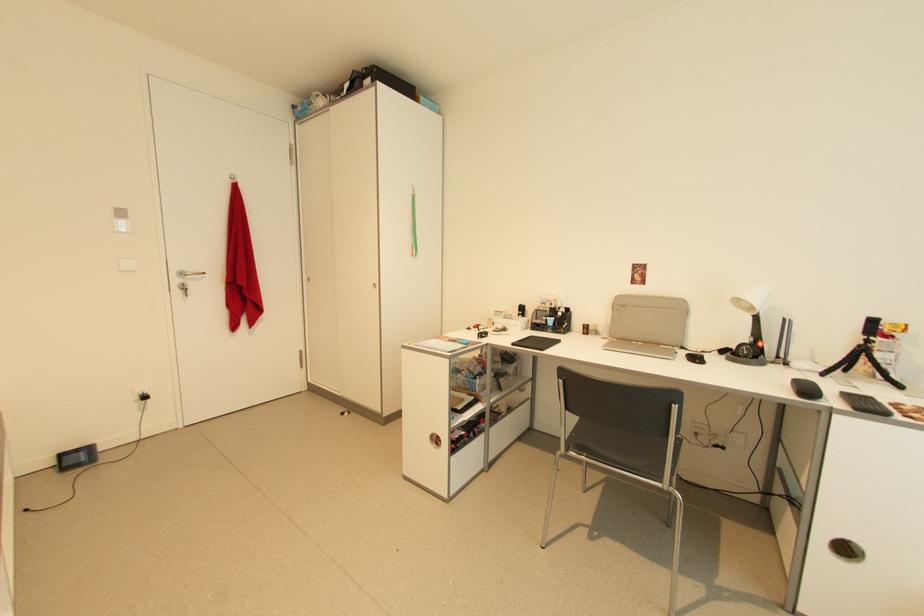
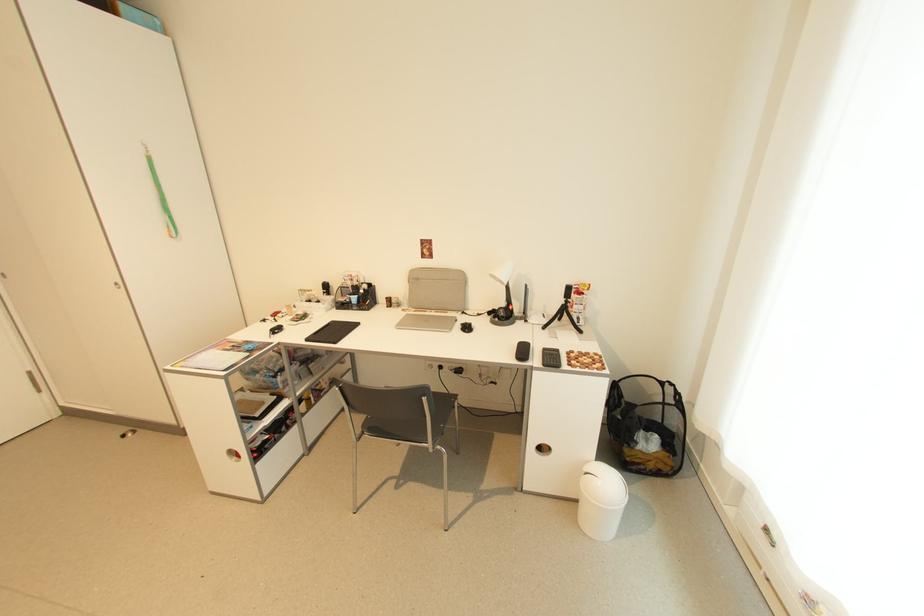
In the second image, find the point that corresponds to (860,411) in the first image.

(548, 367)